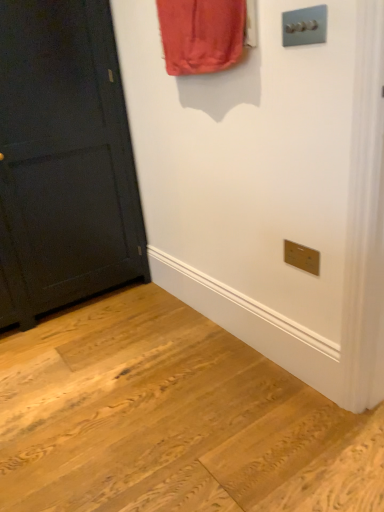
What do you see at coordinates (304, 26) in the screenshot? The width and height of the screenshot is (384, 512). I see `satin silver light switch at upper right` at bounding box center [304, 26].

Identify the location of satin silver light switch at upper right. Image resolution: width=384 pixels, height=512 pixels. (304, 26).

Image resolution: width=384 pixels, height=512 pixels. I want to click on matte black door at left, so click(65, 157).

What do you see at coordinates (65, 157) in the screenshot? The width and height of the screenshot is (384, 512). I see `matte black door at left` at bounding box center [65, 157].

Find the location of a particular element. satin silver light switch at upper right is located at coordinates (304, 26).

Considering the positions of objects matte black door at left and satin silver light switch at upper right in the image provided, who is more to the left, matte black door at left or satin silver light switch at upper right?

From the viewer's perspective, matte black door at left appears more on the left side.

Is the position of matte black door at left more distant than that of satin silver light switch at upper right?

That is True.

Does point (44, 115) come farther from viewer compared to point (318, 39)?

Yes, point (44, 115) is behind point (318, 39).

Consider the image. From the image's perspective, is matte black door at left located above or below satin silver light switch at upper right?

Clearly, from the image's perspective, matte black door at left is below satin silver light switch at upper right.

From a real-world perspective, is matte black door at left positioned above or below satin silver light switch at upper right?

In terms of real-world spatial position, matte black door at left is below satin silver light switch at upper right.

Between matte black door at left and satin silver light switch at upper right, which one has smaller width?

With smaller width is satin silver light switch at upper right.

Does matte black door at left have a lesser height compared to satin silver light switch at upper right?

In fact, matte black door at left may be taller than satin silver light switch at upper right.

Considering the relative sizes of matte black door at left and satin silver light switch at upper right in the image provided, is matte black door at left bigger than satin silver light switch at upper right?

Yes, matte black door at left is bigger than satin silver light switch at upper right.

Choose the correct answer: Is matte black door at left inside satin silver light switch at upper right or outside it?

matte black door at left cannot be found inside satin silver light switch at upper right.

Is matte black door at left not close to satin silver light switch at upper right?

Yes, matte black door at left and satin silver light switch at upper right are quite far apart.

Is matte black door at left oriented towards satin silver light switch at upper right?

Yes, matte black door at left is facing satin silver light switch at upper right.

Consider the image. How different are the orientations of matte black door at left and satin silver light switch at upper right in degrees?

They differ by 89.1 degrees in their facing directions.

Measure the distance between matte black door at left and satin silver light switch at upper right.

1.18 meters.

Locate an element on the screen. light switch on the right of matte black door at left is located at coordinates [x=304, y=26].

Does satin silver light switch at upper right appear on the right side of matte black door at left?

Yes, satin silver light switch at upper right is to the right of matte black door at left.

Is the position of satin silver light switch at upper right less distant than that of matte black door at left?

Yes, the depth of satin silver light switch at upper right is less than that of matte black door at left.

Is point (325, 40) less distant than point (13, 281)?

Yes, it is.

From the image's perspective, which object appears higher, satin silver light switch at upper right or matte black door at left?

satin silver light switch at upper right.

From a real-world perspective, between satin silver light switch at upper right and matte black door at left, who is vertically lower?

From a 3D spatial view, matte black door at left is below.

Between satin silver light switch at upper right and matte black door at left, which one has smaller width?

Thinner between the two is satin silver light switch at upper right.

Considering the relative sizes of satin silver light switch at upper right and matte black door at left in the image provided, is satin silver light switch at upper right shorter than matte black door at left?

Yes.

Is satin silver light switch at upper right smaller than matte black door at left?

Yes.

Is satin silver light switch at upper right spatially inside matte black door at left, or outside of it?

The correct answer is: outside.

Is satin silver light switch at upper right placed right next to matte black door at left?

No.

Based on the photo, is satin silver light switch at upper right aimed at matte black door at left?

No, satin silver light switch at upper right is not oriented towards matte black door at left.

What's the angular difference between satin silver light switch at upper right and matte black door at left's facing directions?

The angle between the facing direction of satin silver light switch at upper right and the facing direction of matte black door at left is 89.1 degrees.

The width and height of the screenshot is (384, 512). In the image, there is a satin silver light switch at upper right. In order to click on door below it (from the image's perspective) in this screenshot , I will do `click(65, 157)`.

Find the location of `door below the satin silver light switch at upper right (from the image's perspective)`. door below the satin silver light switch at upper right (from the image's perspective) is located at coordinates (65, 157).

Locate an element on the screen. The height and width of the screenshot is (512, 384). door below the satin silver light switch at upper right (from a real-world perspective) is located at coordinates (65, 157).